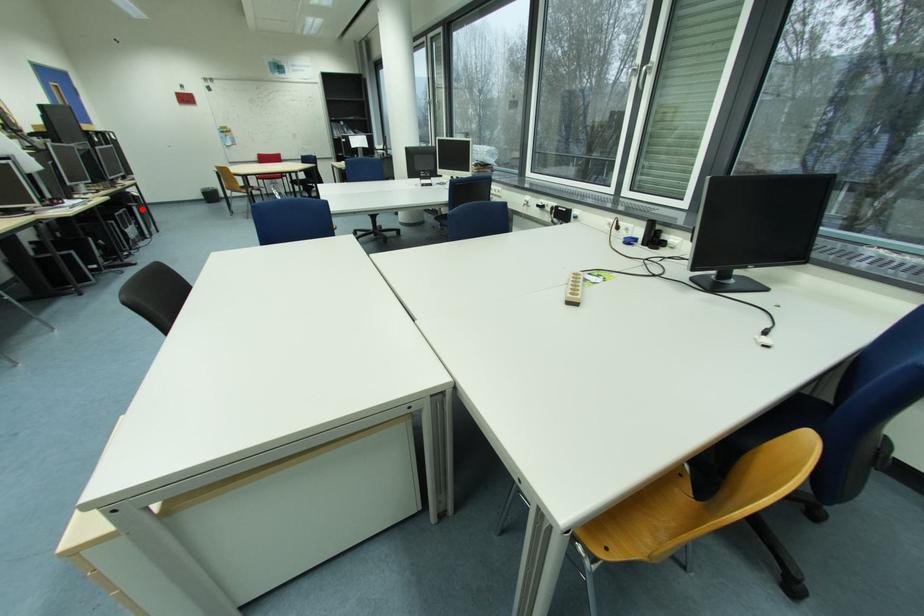
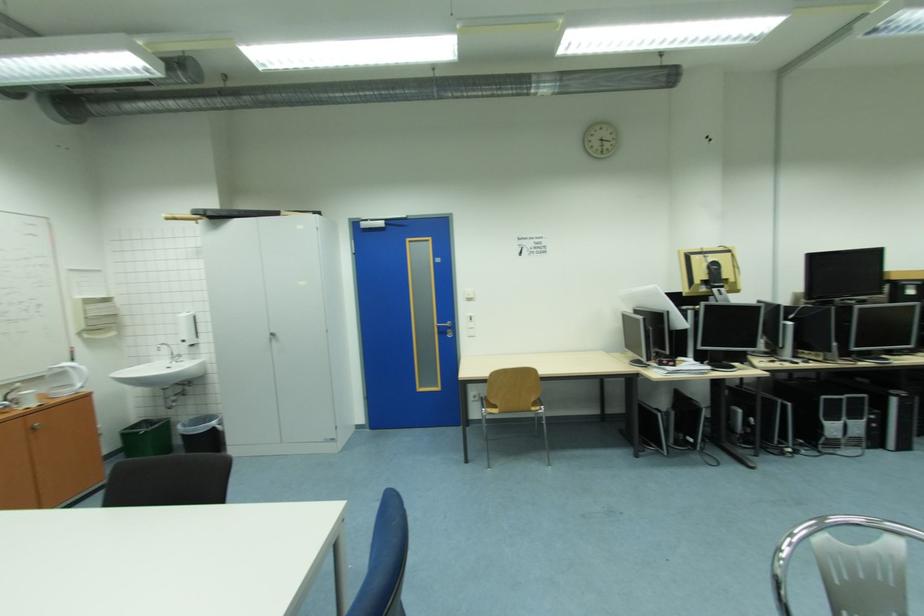
Where in the second image is the point corresponding to the highlighted location from the first image?

(901, 400)